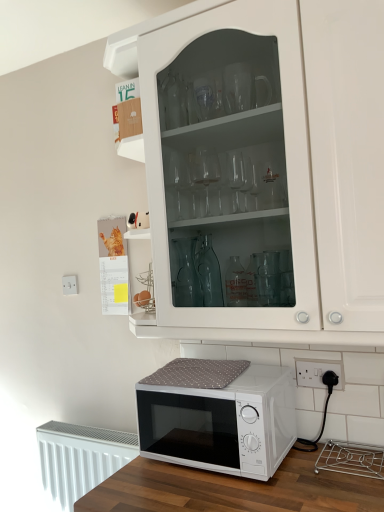
Question: Is white plastic electric outlet at lower right, the second electric outlet in the back-to-front sequence, looking in the opposite direction of white glass cabinet at upper center?

Choices:
 (A) yes
 (B) no

Answer: (B)

Question: Can you confirm if white plastic electric outlet at lower right, the 1th electric outlet when ordered from front to back, is bigger than white glass cabinet at upper center?

Choices:
 (A) yes
 (B) no

Answer: (B)

Question: Is white plastic electric outlet at lower right, positioned as the second electric outlet in top-to-bottom order, wider than white glass cabinet at upper center?

Choices:
 (A) yes
 (B) no

Answer: (B)

Question: From the image's perspective, is white plastic electric outlet at lower right, which appears as the 1th electric outlet when viewed from the right, over white glass cabinet at upper center?

Choices:
 (A) yes
 (B) no

Answer: (B)

Question: Can you confirm if white plastic electric outlet at lower right, positioned as the second electric outlet in top-to-bottom order, is positioned to the left of white glass cabinet at upper center?

Choices:
 (A) yes
 (B) no

Answer: (B)

Question: From a real-world perspective, is white textured radiator at lower left above or below white plastic electric outlet at lower right, which appears as the 1th electric outlet when viewed from the right?

Choices:
 (A) below
 (B) above

Answer: (A)

Question: In terms of height, does white textured radiator at lower left look taller or shorter compared to white plastic electric outlet at lower right, the second electric outlet in the back-to-front sequence?

Choices:
 (A) short
 (B) tall

Answer: (B)

Question: Based on their sizes in the image, would you say white textured radiator at lower left is bigger or smaller than white plastic electric outlet at lower right, the 1th electric outlet when ordered from front to back?

Choices:
 (A) small
 (B) big

Answer: (B)

Question: In the image, is white textured radiator at lower left positioned in front of or behind white plastic electric outlet at lower right, which is the 2th electric outlet from left to right?

Choices:
 (A) front
 (B) behind

Answer: (B)

Question: Is white glass cabinet at upper center taller or shorter than white matte microwave at lower center?

Choices:
 (A) tall
 (B) short

Answer: (A)

Question: From the image's perspective, is white glass cabinet at upper center above or below white matte microwave at lower center?

Choices:
 (A) below
 (B) above

Answer: (B)

Question: Considering their positions, is white glass cabinet at upper center located in front of or behind white matte microwave at lower center?

Choices:
 (A) front
 (B) behind

Answer: (A)

Question: Visually, is white glass cabinet at upper center positioned to the left or to the right of white matte microwave at lower center?

Choices:
 (A) right
 (B) left

Answer: (A)

Question: From a real-world perspective, is white matte microwave at lower center above or below white glass cabinet at upper center?

Choices:
 (A) below
 (B) above

Answer: (A)

Question: Is white matte microwave at lower center in front of or behind white glass cabinet at upper center in the image?

Choices:
 (A) front
 (B) behind

Answer: (B)